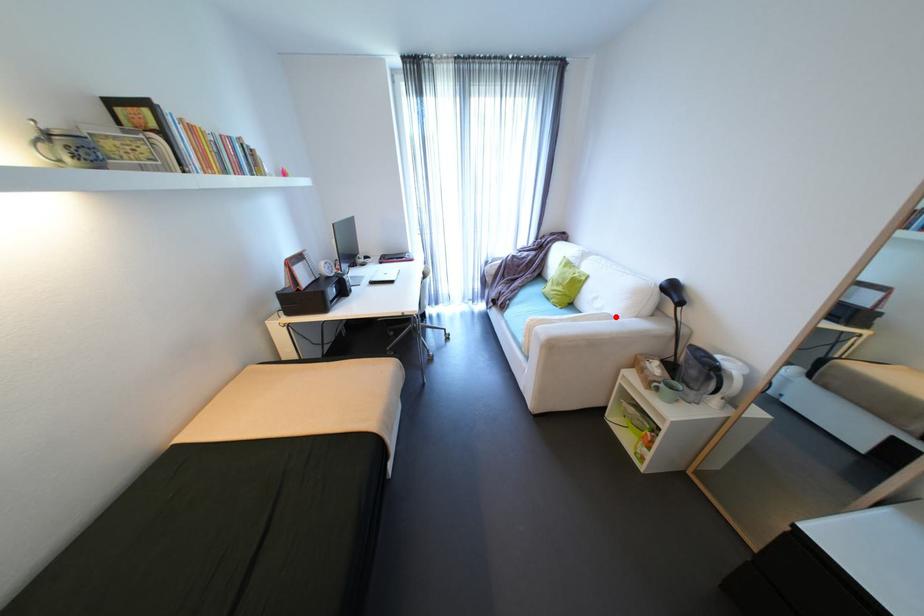
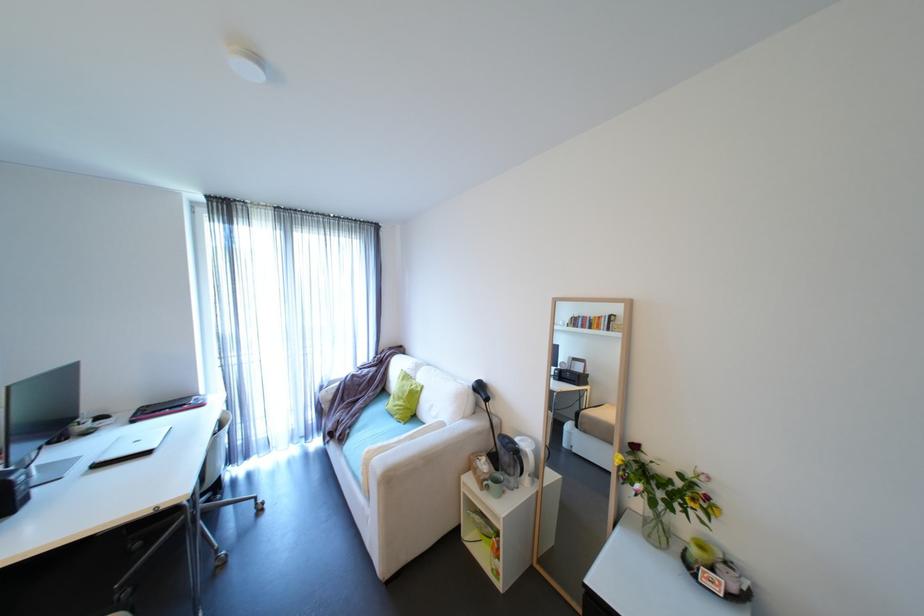
Question: I am providing you with two images of the same scene from different viewpoints. A red point is marked on the first image. Can you still see the location of the red point in image 2?

Choices:
 (A) Yes
 (B) No

Answer: (A)